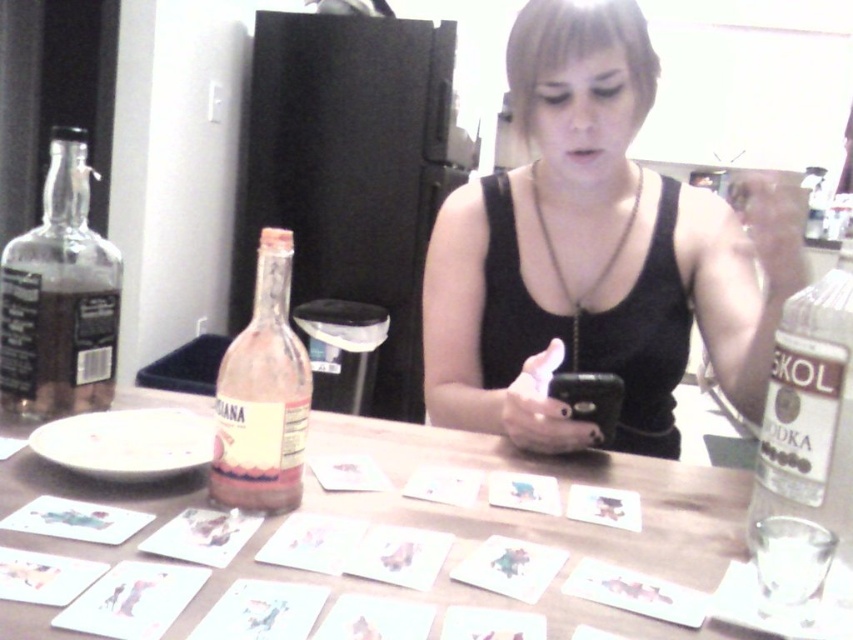
Is point (39, 230) farther from camera compared to point (289, 477)?

Yes, it is behind point (289, 477).

Is point (86, 378) farther from viewer compared to point (260, 364)?

That is True.

What are the coordinates of `transparent glass bottle at left` in the screenshot? It's located at point(59,298).

Identify the location of black matte tank top at center. This screenshot has height=640, width=853. (596, 252).

Can you confirm if black matte tank top at center is positioned below pink glass bottle at center-left?

Incorrect, black matte tank top at center is not positioned below pink glass bottle at center-left.

Locate an element on the screen. black matte tank top at center is located at coordinates (596, 252).

Who is more distant from viewer, (534, 240) or (500, 518)?

Positioned behind is point (534, 240).

Does point (758, 241) lie in front of point (338, 444)?

Yes, it is.

You are a GUI agent. You are given a task and a screenshot of the screen. Output one action in this format:
    pyautogui.click(x=<x>, y=<y>)
    Task: Click on the black matte tank top at center
    This screenshot has width=853, height=640.
    Given the screenshot: What is the action you would take?
    pyautogui.click(x=596, y=252)